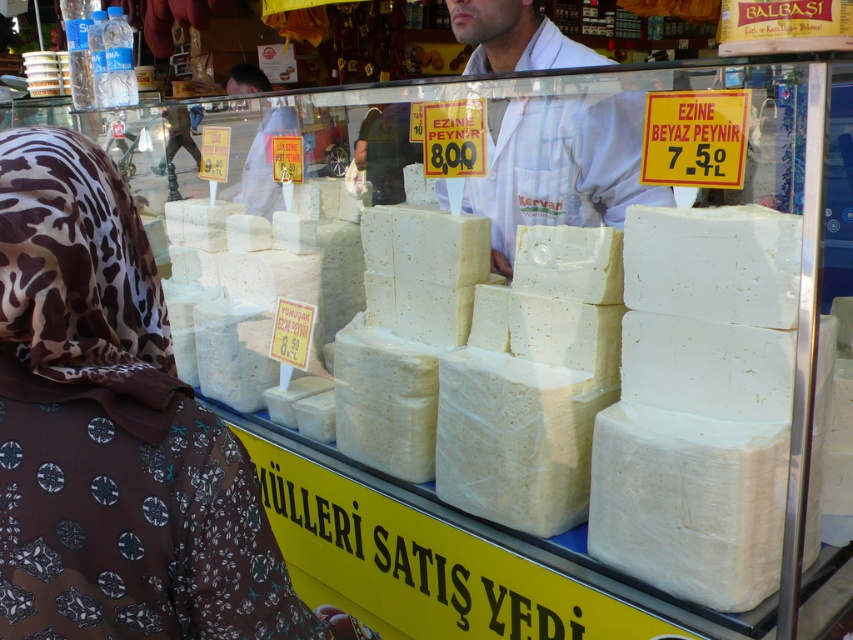
Question: Which object appears farthest from the camera in this image?

Choices:
 (A) white lab coat at center
 (B) brown printed fabric at lower left

Answer: (A)

Question: Does white crumbly cheese at center have a larger size compared to white lab coat at center?

Choices:
 (A) no
 (B) yes

Answer: (B)

Question: Which point is farther to the camera?

Choices:
 (A) (651, 285)
 (B) (35, 262)
 (C) (538, 109)

Answer: (C)

Question: Among these points, which one is nearest to the camera?

Choices:
 (A) (569, 160)
 (B) (631, 266)
 (C) (103, 339)

Answer: (C)

Question: Can you confirm if white crumbly cheese at center is positioned below white lab coat at center?

Choices:
 (A) no
 (B) yes

Answer: (B)

Question: In this image, where is brown printed fabric at lower left located relative to white crumbly cheese at center?

Choices:
 (A) below
 (B) above

Answer: (B)